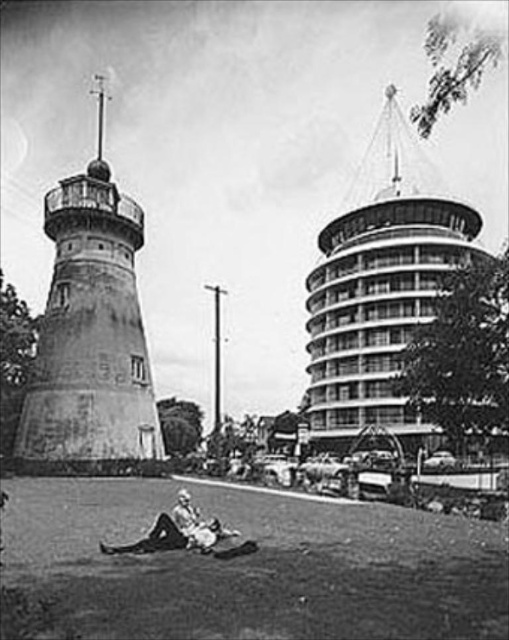
Can you confirm if smooth concrete tower at upper right is positioned below rustic concrete water tower at left?

Correct, smooth concrete tower at upper right is located below rustic concrete water tower at left.

Between point (448, 241) and point (52, 401), which one is positioned behind?

Point (448, 241)

Where is `smooth concrete tower at upper right`? The height and width of the screenshot is (640, 509). smooth concrete tower at upper right is located at coordinates (380, 285).

Between green grass at lower center and smooth concrete tower at upper right, which one appears on the left side from the viewer's perspective?

Positioned to the left is green grass at lower center.

Locate an element on the screen. The image size is (509, 640). green grass at lower center is located at coordinates (x=257, y=564).

Is point (184, 602) positioned in front of point (335, 288)?

Yes.

The image size is (509, 640). In order to click on green grass at lower center in this screenshot , I will do `click(257, 564)`.

Does green grass at lower center come in front of light beige fabric at lower center?

Yes, green grass at lower center is closer to the viewer.

From the picture: Does green grass at lower center have a larger size compared to light beige fabric at lower center?

Indeed, green grass at lower center has a larger size compared to light beige fabric at lower center.

The image size is (509, 640). I want to click on green grass at lower center, so click(x=257, y=564).

Where is `green grass at lower center`? This screenshot has height=640, width=509. green grass at lower center is located at coordinates (257, 564).